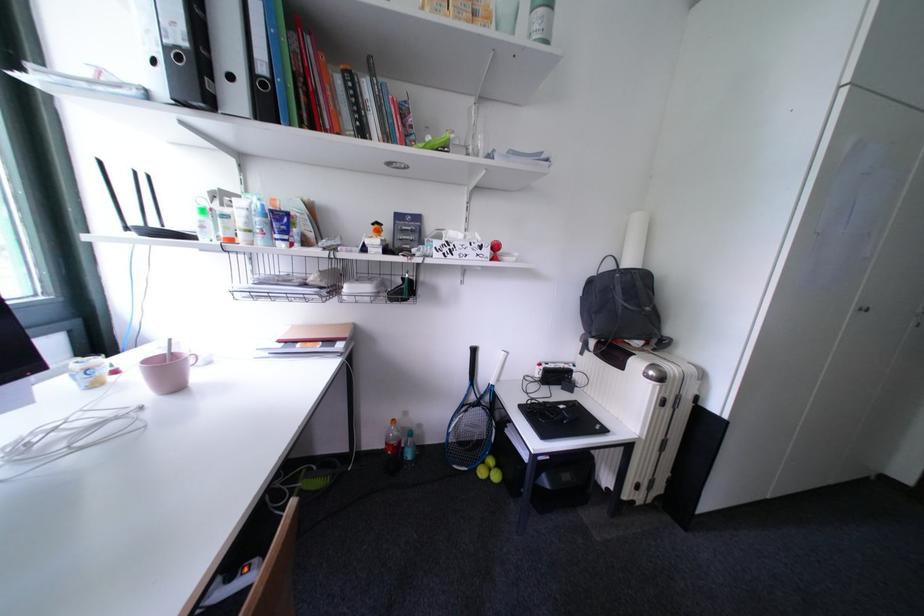
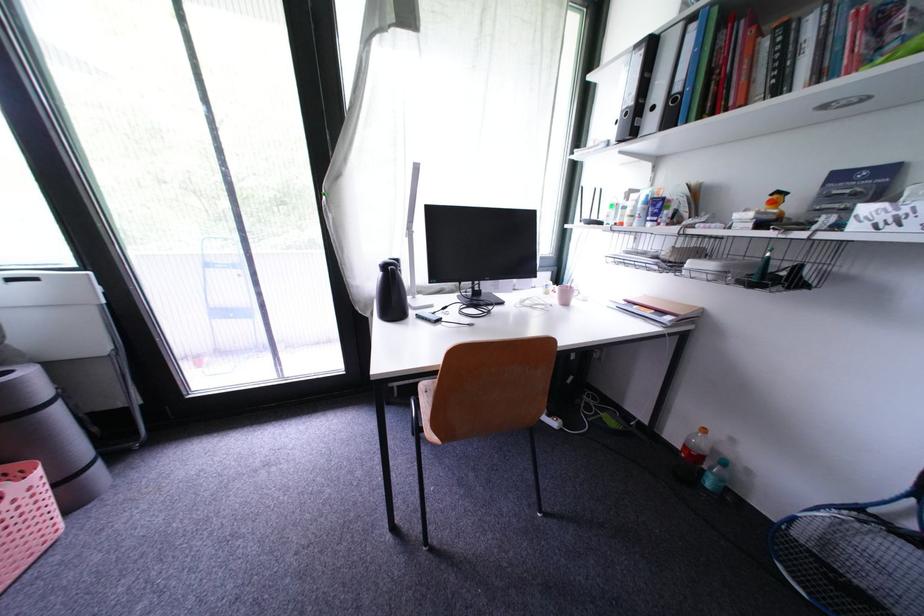
The point at [354,338] is marked in the first image. Where is the corresponding point in the second image?

(689, 315)